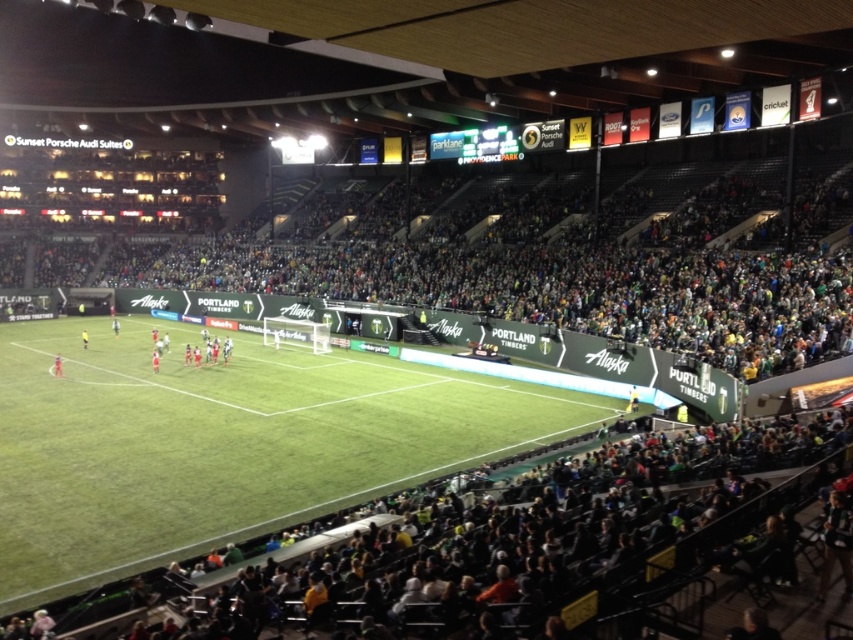
Between point (61, 356) and point (85, 333), which one is positioned behind?

The point (85, 333) is behind.

In the scene shown: Can you confirm if red fabric person at center is bigger than yellow fabric person at center?

No.

Where is `red fabric person at center`? red fabric person at center is located at coordinates click(57, 365).

Does green artificial turf at center appear over green fabric crowd at center?

No, green artificial turf at center is not above green fabric crowd at center.

I want to click on green artificial turf at center, so click(x=223, y=444).

Is point (310, 502) behind point (108, 262)?

That is False.

You are a GUI agent. You are given a task and a screenshot of the screen. Output one action in this format:
    pyautogui.click(x=<x>, y=<y>)
    Task: Click on the green artificial turf at center
    This screenshot has width=853, height=640.
    Given the screenshot: What is the action you would take?
    pyautogui.click(x=223, y=444)

Does green fabric crowd at center have a greater width compared to red fabric person at center?

Yes.

Is green fabric crowd at center closer to the viewer compared to red fabric person at center?

Yes.

Which is behind, point (584, 266) or point (61, 364)?

Positioned behind is point (584, 266).

Where is `green fabric crowd at center`? green fabric crowd at center is located at coordinates (517, 278).